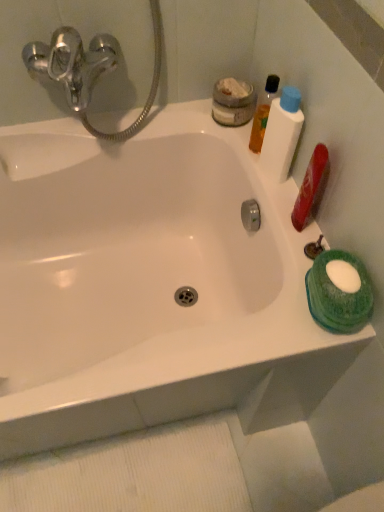
Question: Is white plastic bottle at upper right, which appears as the 3th mouthwash when viewed from the top, at the back of matte gray jar at upper right, placed as the first mouthwash when sorted from top to bottom?

Choices:
 (A) yes
 (B) no

Answer: (B)

Question: Are matte gray jar at upper right, placed as the first mouthwash when sorted from top to bottom, and white plastic bottle at upper right, the third mouthwash positioned from the bottom, making contact?

Choices:
 (A) yes
 (B) no

Answer: (B)

Question: From the image's perspective, does matte gray jar at upper right, placed as the fifth mouthwash when sorted from bottom to top, appear lower than white plastic bottle at upper right, the third mouthwash positioned from the bottom?

Choices:
 (A) no
 (B) yes

Answer: (A)

Question: Is matte gray jar at upper right, placed as the fifth mouthwash when sorted from bottom to top, far from white plastic bottle at upper right, which appears as the 3th mouthwash when viewed from the top?

Choices:
 (A) yes
 (B) no

Answer: (B)

Question: Is white plastic bottle at upper right, which appears as the 3th mouthwash when viewed from the top, inside matte gray jar at upper right, placed as the first mouthwash when sorted from top to bottom?

Choices:
 (A) yes
 (B) no

Answer: (B)

Question: Can you confirm if matte gray jar at upper right, placed as the fifth mouthwash when sorted from bottom to top, is wider than white plastic bottle at upper right, which appears as the 3th mouthwash when viewed from the top?

Choices:
 (A) yes
 (B) no

Answer: (A)

Question: Can we say green sponge at right, which appears as the 5th mouthwash when viewed from the top, lies outside matte gray jar at upper right, placed as the fifth mouthwash when sorted from bottom to top?

Choices:
 (A) no
 (B) yes

Answer: (B)

Question: Is green sponge at right, placed as the first mouthwash when sorted from bottom to top, thinner than matte gray jar at upper right, placed as the fifth mouthwash when sorted from bottom to top?

Choices:
 (A) no
 (B) yes

Answer: (B)

Question: Is green sponge at right, which appears as the 5th mouthwash when viewed from the top, wider than matte gray jar at upper right, placed as the fifth mouthwash when sorted from bottom to top?

Choices:
 (A) yes
 (B) no

Answer: (B)

Question: From the image's perspective, does green sponge at right, placed as the first mouthwash when sorted from bottom to top, appear higher than matte gray jar at upper right, placed as the first mouthwash when sorted from top to bottom?

Choices:
 (A) yes
 (B) no

Answer: (B)

Question: Is green sponge at right, placed as the first mouthwash when sorted from bottom to top, taller than matte gray jar at upper right, placed as the first mouthwash when sorted from top to bottom?

Choices:
 (A) no
 (B) yes

Answer: (B)

Question: Is matte gray jar at upper right, placed as the first mouthwash when sorted from top to bottom, completely or partially inside green sponge at right, which appears as the 5th mouthwash when viewed from the top?

Choices:
 (A) no
 (B) yes

Answer: (A)

Question: Does green sponge at right, placed as the first mouthwash when sorted from bottom to top, have a lesser height compared to translucent orange liquid at upper right, the second mouthwash positioned from the top?

Choices:
 (A) yes
 (B) no

Answer: (A)